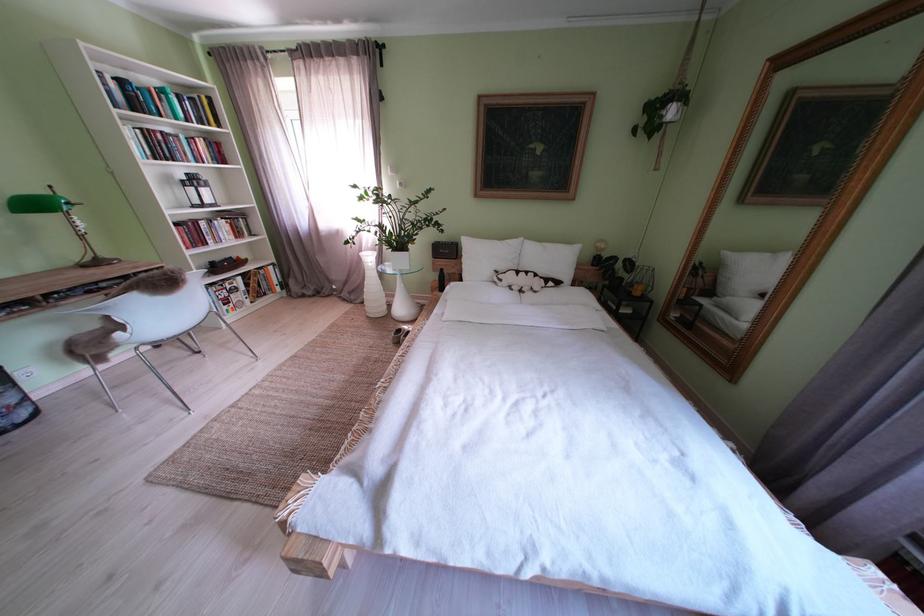
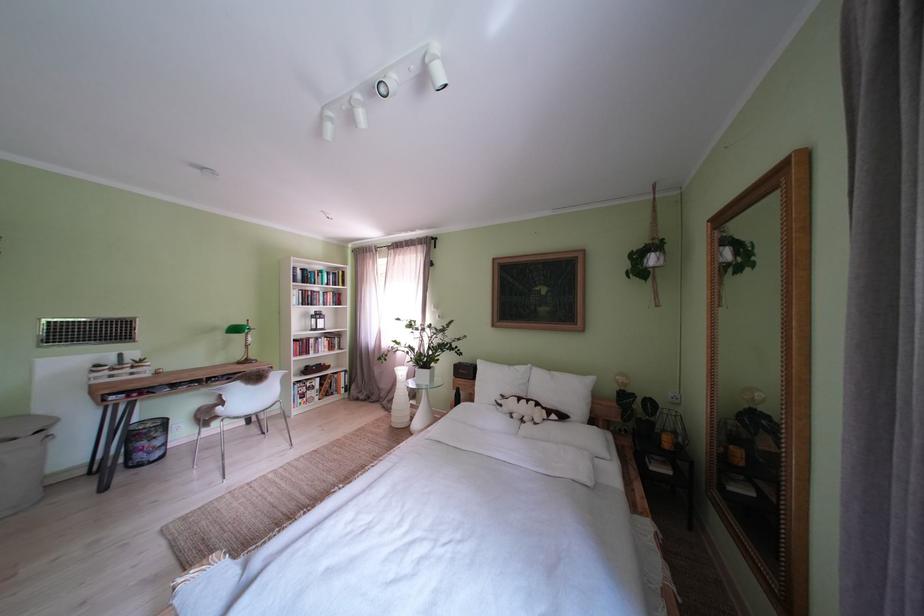
In the second image, find the point that corresponds to point 532,244 in the first image.

(541, 371)